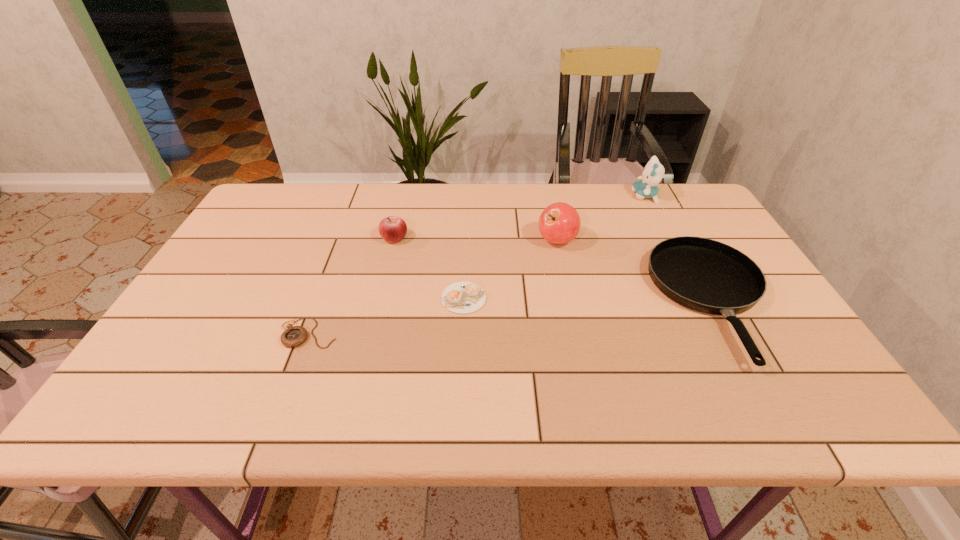
At what (x,y) coordinates should I click in order to perform the action: click on kitten. Please return your answer as a coordinate pair (x, y). Looking at the image, I should click on (652, 174).

Image resolution: width=960 pixels, height=540 pixels. I want to click on the taller apple, so click(559, 223).

You are a GUI agent. You are given a task and a screenshot of the screen. Output one action in this format:
    pyautogui.click(x=<x>, y=<y>)
    Task: Click on the third object from right to left
    
    Given the screenshot: What is the action you would take?
    pyautogui.click(x=559, y=223)

Locate an element on the screen. the third tallest object is located at coordinates tap(392, 229).

What are the coordinates of `the shorter apple` in the screenshot? It's located at (392, 229).

This screenshot has height=540, width=960. I want to click on frying pan, so click(x=702, y=274).

Locate an element on the screen. the third object from left to right is located at coordinates (462, 297).

Locate an element on the screen. The image size is (960, 540). cappuccino is located at coordinates (462, 297).

This screenshot has height=540, width=960. In order to click on pocket watch in this screenshot , I will do `click(294, 336)`.

You are a GUI agent. You are given a task and a screenshot of the screen. Output one action in this format:
    pyautogui.click(x=<x>, y=<y>)
    Task: Click on the shortest object
    The height and width of the screenshot is (540, 960).
    Given the screenshot: What is the action you would take?
    pyautogui.click(x=294, y=336)